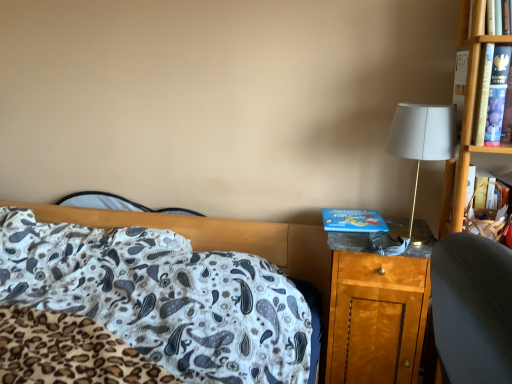
Where is `free point below blue cardboard book at right (from a real-world perspective)`? free point below blue cardboard book at right (from a real-world perspective) is located at coordinates (347, 223).